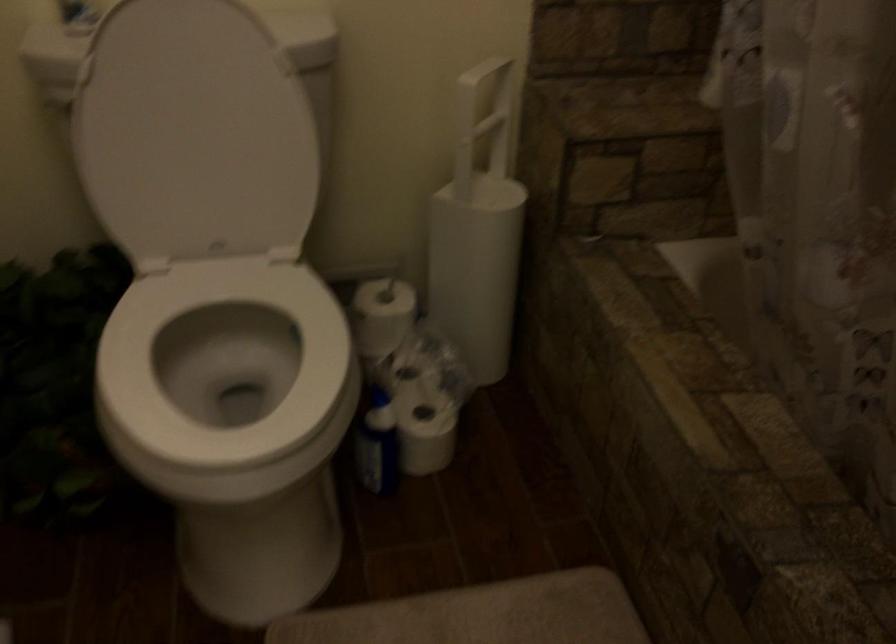
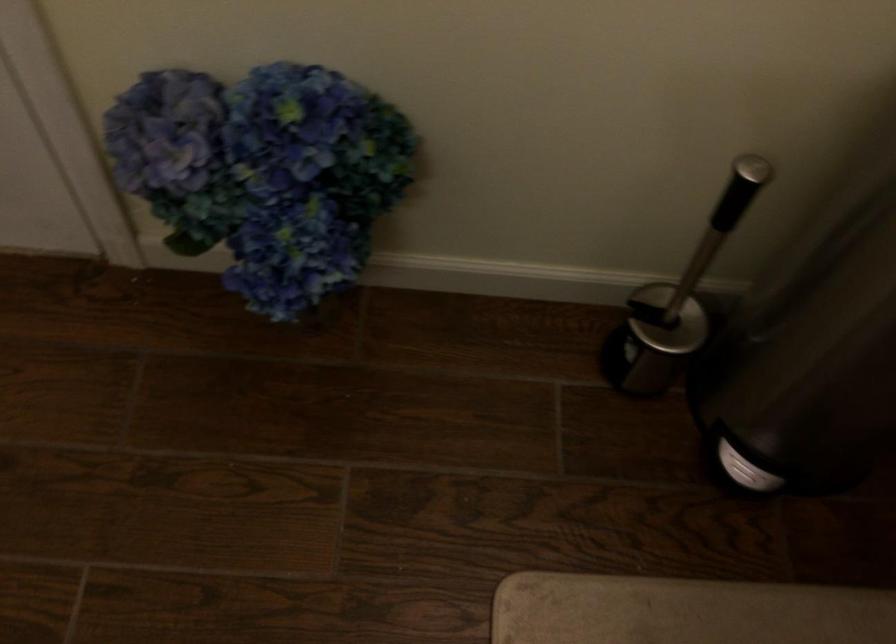
How did the camera likely rotate?

The camera's rotation is toward left-down.